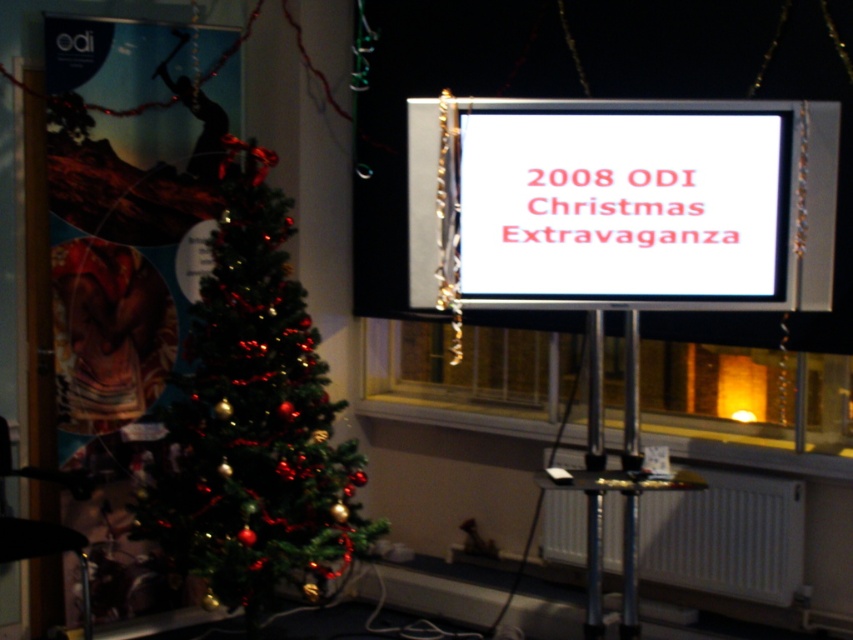
Is white glossy screen at center bigger than white plastic radiator at lower right?

No.

Based on the photo, between white glossy screen at center and white plastic radiator at lower right, which one has more height?

Standing taller between the two is white glossy screen at center.

What do you see at coordinates (624, 205) in the screenshot?
I see `white glossy screen at center` at bounding box center [624, 205].

At what (x,y) coordinates should I click in order to perform the action: click on white glossy screen at center. Please return your answer as a coordinate pair (x, y). This screenshot has width=853, height=640. Looking at the image, I should click on (624, 205).

Is point (299, 483) positioned after point (473, 141)?

Yes, it is behind point (473, 141).

In the scene shown: Can you confirm if green shiny christmas tree at left is positioned above white glossy screen at center?

No.

Between point (314, 451) and point (741, 273), which one is positioned behind?

The point (314, 451) is behind.

In order to click on green shiny christmas tree at left in this screenshot , I will do `click(253, 420)`.

Between green shiny christmas tree at left and white plastic radiator at lower right, which one has more height?

green shiny christmas tree at left is taller.

Is point (260, 371) behind point (552, 561)?

No.

What do you see at coordinates (253, 420) in the screenshot? The height and width of the screenshot is (640, 853). I see `green shiny christmas tree at left` at bounding box center [253, 420].

Locate an element on the screen. green shiny christmas tree at left is located at coordinates (253, 420).